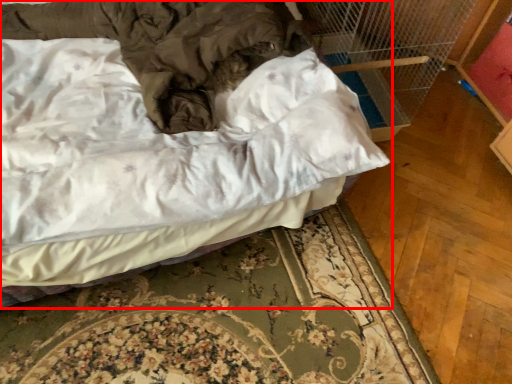
Question: From the image's perspective, considering the relative positions of bed (annotated by the red box) and bed frame in the image provided, where is bed (annotated by the red box) located with respect to the staircase?

Choices:
 (A) above
 (B) below

Answer: (A)